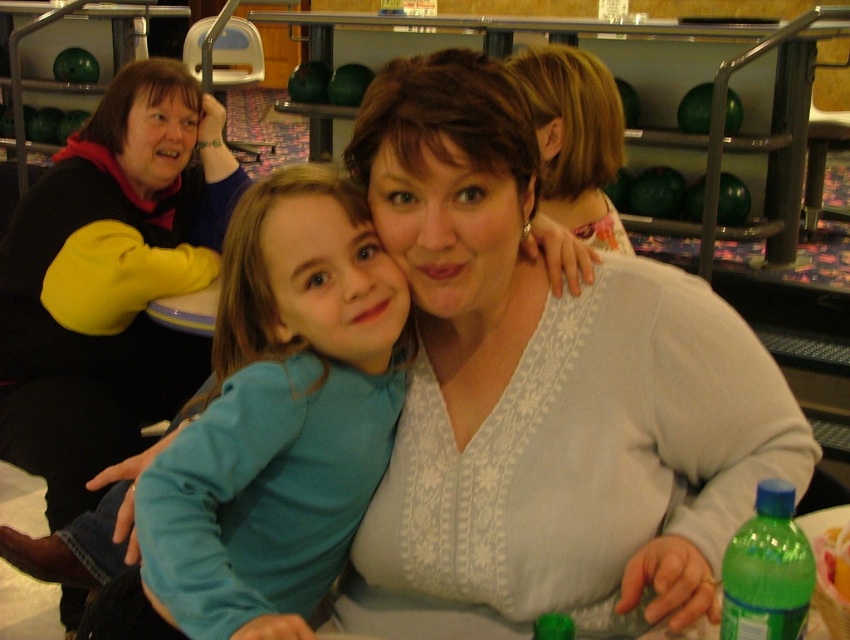
Question: Which point is farther from the camera taking this photo?

Choices:
 (A) (323, 541)
 (B) (604, 208)
 (C) (514, 525)

Answer: (B)

Question: Does light brown hair at upper center lie behind green plastic bottle at lower right?

Choices:
 (A) yes
 (B) no

Answer: (A)

Question: Is teal fabric shirt at center positioned in front of light brown hair at upper center?

Choices:
 (A) yes
 (B) no

Answer: (A)

Question: Can you confirm if white lace sweater at center is thinner than green plastic bottle at lower right?

Choices:
 (A) yes
 (B) no

Answer: (B)

Question: Estimate the real-world distances between objects in this image. Which object is closer to the green plastic bottle at lower right?

Choices:
 (A) teal fabric shirt at center
 (B) white lace sweater at center

Answer: (B)

Question: Based on their relative distances, which object is nearer to the teal fabric shirt at center?

Choices:
 (A) light brown hair at upper center
 (B) green plastic bottle at lower right
 (C) white lace sweater at center

Answer: (C)